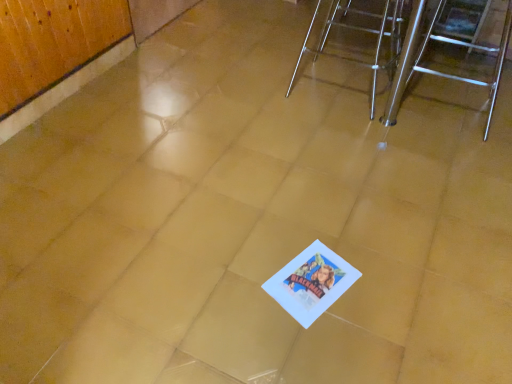
Describe the element at coordinates (361, 31) in the screenshot. I see `metallic silver chair at upper right, acting as the second furniture starting from the right` at that location.

Where is `metallic silver chair at upper right, acting as the first furniture starting from the left`? metallic silver chair at upper right, acting as the first furniture starting from the left is located at coordinates (361, 31).

Where is `polished stainless steel stool at right, which appears as the 1th furniture when viewed from the right`? polished stainless steel stool at right, which appears as the 1th furniture when viewed from the right is located at coordinates (438, 71).

Describe the element at coordinates (438, 71) in the screenshot. The image size is (512, 384). I see `polished stainless steel stool at right, the second furniture in the left-to-right sequence` at that location.

You are a GUI agent. You are given a task and a screenshot of the screen. Output one action in this format:
    pyautogui.click(x=<x>, y=<y>)
    Task: Click on the metallic silver chair at upper right, acting as the second furniture starting from the right
    
    Given the screenshot: What is the action you would take?
    pyautogui.click(x=361, y=31)

In the image, is metallic silver chair at upper right, acting as the first furniture starting from the left, on the left side or the right side of polished stainless steel stool at right, which appears as the 1th furniture when viewed from the right?

metallic silver chair at upper right, acting as the first furniture starting from the left, is to the left of polished stainless steel stool at right, which appears as the 1th furniture when viewed from the right.

Is metallic silver chair at upper right, acting as the second furniture starting from the right, in front of or behind polished stainless steel stool at right, which appears as the 1th furniture when viewed from the right, in the image?

Clearly, metallic silver chair at upper right, acting as the second furniture starting from the right, is behind polished stainless steel stool at right, which appears as the 1th furniture when viewed from the right.

Is point (390, 48) farther from camera compared to point (437, 9)?

No, it is not.

From the image's perspective, which object appears higher, metallic silver chair at upper right, acting as the second furniture starting from the right, or polished stainless steel stool at right, the second furniture in the left-to-right sequence?

metallic silver chair at upper right, acting as the second furniture starting from the right, is shown above in the image.

From a real-world perspective, is metallic silver chair at upper right, acting as the second furniture starting from the right, physically located above or below polished stainless steel stool at right, the second furniture in the left-to-right sequence?

metallic silver chair at upper right, acting as the second furniture starting from the right, is below polished stainless steel stool at right, the second furniture in the left-to-right sequence.

Is metallic silver chair at upper right, acting as the first furniture starting from the left, wider than polished stainless steel stool at right, the second furniture in the left-to-right sequence?

No.

In terms of height, does metallic silver chair at upper right, acting as the first furniture starting from the left, look taller or shorter compared to polished stainless steel stool at right, which appears as the 1th furniture when viewed from the right?

Clearly, metallic silver chair at upper right, acting as the first furniture starting from the left, is shorter compared to polished stainless steel stool at right, which appears as the 1th furniture when viewed from the right.

Consider the image. Does metallic silver chair at upper right, acting as the first furniture starting from the left, have a smaller size compared to polished stainless steel stool at right, the second furniture in the left-to-right sequence?

Correct, metallic silver chair at upper right, acting as the first furniture starting from the left, occupies less space than polished stainless steel stool at right, the second furniture in the left-to-right sequence.

Is metallic silver chair at upper right, acting as the first furniture starting from the left, surrounding polished stainless steel stool at right, which appears as the 1th furniture when viewed from the right?

No, polished stainless steel stool at right, which appears as the 1th furniture when viewed from the right, is not a part of metallic silver chair at upper right, acting as the first furniture starting from the left.

Is metallic silver chair at upper right, acting as the first furniture starting from the left, far from polished stainless steel stool at right, the second furniture in the left-to-right sequence?

metallic silver chair at upper right, acting as the first furniture starting from the left, is near polished stainless steel stool at right, the second furniture in the left-to-right sequence, not far away.

Is metallic silver chair at upper right, acting as the second furniture starting from the right, facing towards polished stainless steel stool at right, which appears as the 1th furniture when viewed from the right?

Yes, metallic silver chair at upper right, acting as the second furniture starting from the right, is oriented towards polished stainless steel stool at right, which appears as the 1th furniture when viewed from the right.

How different are the orientations of metallic silver chair at upper right, acting as the first furniture starting from the left, and polished stainless steel stool at right, which appears as the 1th furniture when viewed from the right, in degrees?

The angular difference between metallic silver chair at upper right, acting as the first furniture starting from the left, and polished stainless steel stool at right, which appears as the 1th furniture when viewed from the right, is 179 degrees.

This screenshot has height=384, width=512. I want to click on furniture lying on the right of metallic silver chair at upper right, acting as the second furniture starting from the right, so click(x=438, y=71).

Looking at this image, considering the relative positions of polished stainless steel stool at right, which appears as the 1th furniture when viewed from the right, and metallic silver chair at upper right, acting as the second furniture starting from the right, in the image provided, is polished stainless steel stool at right, which appears as the 1th furniture when viewed from the right, to the right of metallic silver chair at upper right, acting as the second furniture starting from the right, from the viewer's perspective?

Indeed, polished stainless steel stool at right, which appears as the 1th furniture when viewed from the right, is positioned on the right side of metallic silver chair at upper right, acting as the second furniture starting from the right.

Is the depth of polished stainless steel stool at right, which appears as the 1th furniture when viewed from the right, greater than that of metallic silver chair at upper right, acting as the first furniture starting from the left?

That is False.

Considering the positions of point (389, 121) and point (383, 18), is point (389, 121) closer or farther from the camera than point (383, 18)?

Point (389, 121) is closer to the camera than point (383, 18).

From the image's perspective, which object appears higher, polished stainless steel stool at right, which appears as the 1th furniture when viewed from the right, or metallic silver chair at upper right, acting as the second furniture starting from the right?

metallic silver chair at upper right, acting as the second furniture starting from the right.

From a real-world perspective, is polished stainless steel stool at right, which appears as the 1th furniture when viewed from the right, over metallic silver chair at upper right, acting as the second furniture starting from the right?

Correct, in the physical world, polished stainless steel stool at right, which appears as the 1th furniture when viewed from the right, is higher than metallic silver chair at upper right, acting as the second furniture starting from the right.

Does polished stainless steel stool at right, which appears as the 1th furniture when viewed from the right, have a lesser width compared to metallic silver chair at upper right, acting as the second furniture starting from the right?

No.

Is polished stainless steel stool at right, the second furniture in the left-to-right sequence, taller or shorter than metallic silver chair at upper right, acting as the first furniture starting from the left?

polished stainless steel stool at right, the second furniture in the left-to-right sequence, is taller than metallic silver chair at upper right, acting as the first furniture starting from the left.

Between polished stainless steel stool at right, which appears as the 1th furniture when viewed from the right, and metallic silver chair at upper right, acting as the first furniture starting from the left, which one has larger size?

Bigger between the two is polished stainless steel stool at right, which appears as the 1th furniture when viewed from the right.

Is metallic silver chair at upper right, acting as the second furniture starting from the right, inside polished stainless steel stool at right, the second furniture in the left-to-right sequence?

That's incorrect, metallic silver chair at upper right, acting as the second furniture starting from the right, is not inside polished stainless steel stool at right, the second furniture in the left-to-right sequence.

Does polished stainless steel stool at right, which appears as the 1th furniture when viewed from the right, touch metallic silver chair at upper right, acting as the second furniture starting from the right?

No, polished stainless steel stool at right, which appears as the 1th furniture when viewed from the right, is not making contact with metallic silver chair at upper right, acting as the second furniture starting from the right.

Is polished stainless steel stool at right, which appears as the 1th furniture when viewed from the right, positioned with its back to metallic silver chair at upper right, acting as the first furniture starting from the left?

polished stainless steel stool at right, which appears as the 1th furniture when viewed from the right, does not have its back to metallic silver chair at upper right, acting as the first furniture starting from the left.

What's the angular difference between polished stainless steel stool at right, the second furniture in the left-to-right sequence, and metallic silver chair at upper right, acting as the first furniture starting from the left,'s facing directions?

The facing directions of polished stainless steel stool at right, the second furniture in the left-to-right sequence, and metallic silver chair at upper right, acting as the first furniture starting from the left, are 179 degrees apart.

Measure the distance from polished stainless steel stool at right, the second furniture in the left-to-right sequence, to metallic silver chair at upper right, acting as the first furniture starting from the left.

The distance of polished stainless steel stool at right, the second furniture in the left-to-right sequence, from metallic silver chair at upper right, acting as the first furniture starting from the left, is 11.04 inches.

Locate an element on the screen. The image size is (512, 384). furniture that appears in front of the metallic silver chair at upper right, acting as the first furniture starting from the left is located at coordinates (438, 71).

Find the location of a particular element. Image resolution: width=512 pixels, height=384 pixels. furniture on the right of metallic silver chair at upper right, acting as the first furniture starting from the left is located at coordinates (438, 71).

Where is `furniture above the metallic silver chair at upper right, acting as the first furniture starting from the left (from a real-world perspective)`? furniture above the metallic silver chair at upper right, acting as the first furniture starting from the left (from a real-world perspective) is located at coordinates (438, 71).